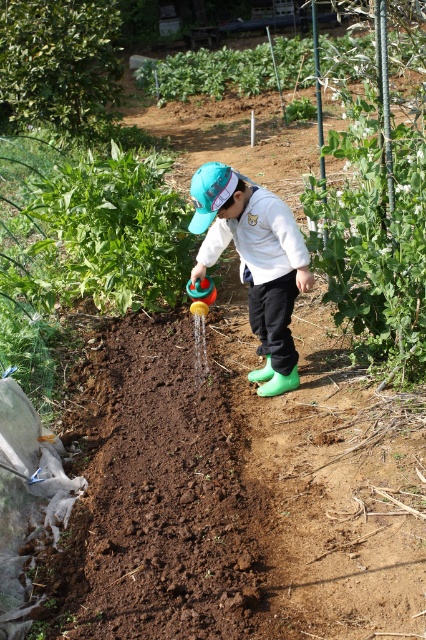
Which is behind, point (386, 378) or point (256, 241)?

Point (386, 378)

Between green leafy plant at right and rubber boots at center, which one appears on the left side from the viewer's perspective?

rubber boots at center is more to the left.

Which is behind, point (386, 90) or point (279, 205)?

Positioned behind is point (386, 90).

You are a GUI agent. You are given a task and a screenshot of the screen. Output one action in this format:
    pyautogui.click(x=<x>, y=<y>)
    Task: Click on the green leafy plant at right
    Image resolution: width=426 pixels, height=640 pixels.
    Given the screenshot: What is the action you would take?
    pyautogui.click(x=377, y=228)

Is green leafy plant at right below green leafy plant at upper center?

Correct, green leafy plant at right is located below green leafy plant at upper center.

Looking at this image, does green leafy plant at right have a lesser height compared to green leafy plant at upper center?

Yes.

Who is more distant from viewer, (405, 346) or (184, 84)?

Point (184, 84)

I want to click on green leafy plant at right, so click(x=377, y=228).

Measure the distance between rubber boots at center and green leafy plant at upper center.

They are 7.72 meters apart.

Who is more distant from viewer, (247,193) or (161,77)?

The point (161,77) is more distant.

Is point (296, 232) positioned after point (250, 56)?

No, (296, 232) is in front of (250, 56).

Image resolution: width=426 pixels, height=640 pixels. What are the coordinates of `rubber boots at center` in the screenshot? It's located at (255, 260).